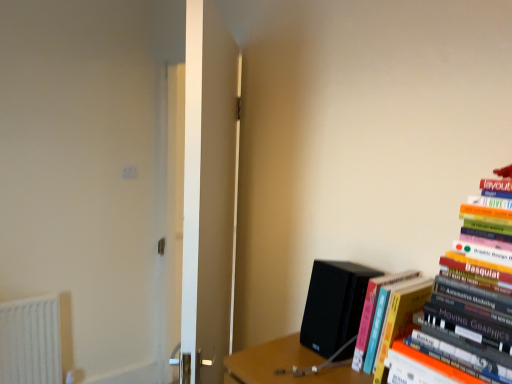
Question: From a real-world perspective, is white glossy door at center located higher than hardcover books at right, positioned as the second book in back-to-front order?

Choices:
 (A) no
 (B) yes

Answer: (A)

Question: Is white glossy door at center oriented away from hardcover books at right, placed as the first book when sorted from front to back?

Choices:
 (A) no
 (B) yes

Answer: (B)

Question: Does white glossy door at center have a lesser height compared to hardcover books at right, placed as the first book when sorted from front to back?

Choices:
 (A) yes
 (B) no

Answer: (B)

Question: Does white glossy door at center have a lesser width compared to hardcover books at right, positioned as the second book in back-to-front order?

Choices:
 (A) yes
 (B) no

Answer: (A)

Question: Considering the relative sizes of white glossy door at center and hardcover books at right, placed as the first book when sorted from front to back, in the image provided, is white glossy door at center bigger than hardcover books at right, placed as the first book when sorted from front to back,?

Choices:
 (A) no
 (B) yes

Answer: (B)

Question: Would you consider white glossy door at center to be distant from hardcover books at right, positioned as the second book in back-to-front order?

Choices:
 (A) no
 (B) yes

Answer: (A)

Question: Could you tell me if black matte speaker at lower right is turned towards orange matte book at right, which appears as the first book when viewed from the back?

Choices:
 (A) yes
 (B) no

Answer: (B)

Question: Can you confirm if black matte speaker at lower right is taller than orange matte book at right, which appears as the first book when viewed from the back?

Choices:
 (A) yes
 (B) no

Answer: (B)

Question: Is black matte speaker at lower right shorter than orange matte book at right, which appears as the first book when viewed from the back?

Choices:
 (A) no
 (B) yes

Answer: (B)

Question: From a real-world perspective, does black matte speaker at lower right stand above orange matte book at right, which appears as the first book when viewed from the back?

Choices:
 (A) no
 (B) yes

Answer: (B)

Question: From the image's perspective, is black matte speaker at lower right above orange matte book at right, which is the second book from front to back?

Choices:
 (A) yes
 (B) no

Answer: (A)

Question: Is black matte speaker at lower right positioned with its back to orange matte book at right, which appears as the first book when viewed from the back?

Choices:
 (A) no
 (B) yes

Answer: (A)

Question: Considering the relative positions of orange matte book at right, which is the second book from front to back, and black matte speaker at lower right in the image provided, is orange matte book at right, which is the second book from front to back, to the left of black matte speaker at lower right from the viewer's perspective?

Choices:
 (A) yes
 (B) no

Answer: (B)